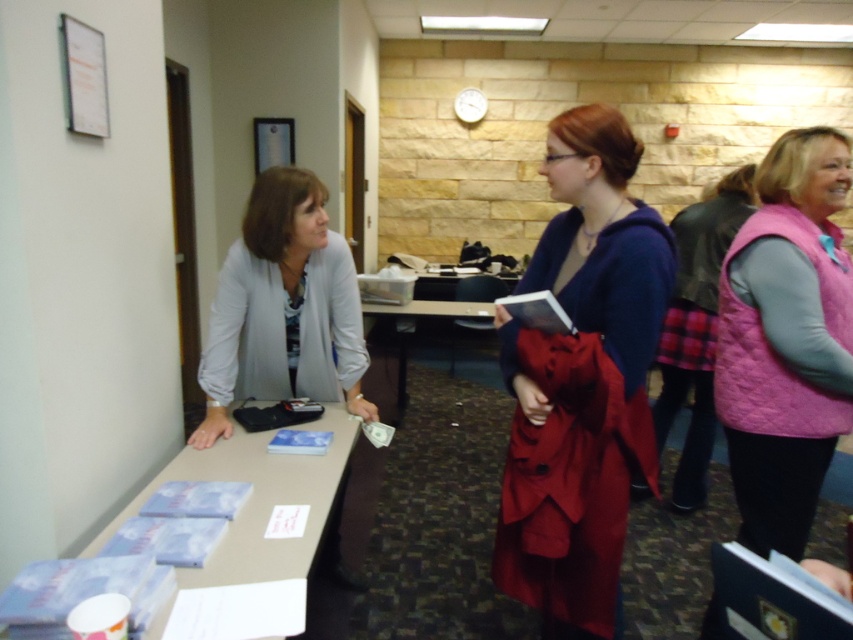
From the picture: You are a visitor entering the office and want to approach both the matte gray blazer at center and the light brown laminate table at lower left. Which object will you encounter first as you move forward?

The matte gray blazer at center is closer to you than the light brown laminate table at lower left, so you will encounter the matte gray blazer at center first as you move forward.